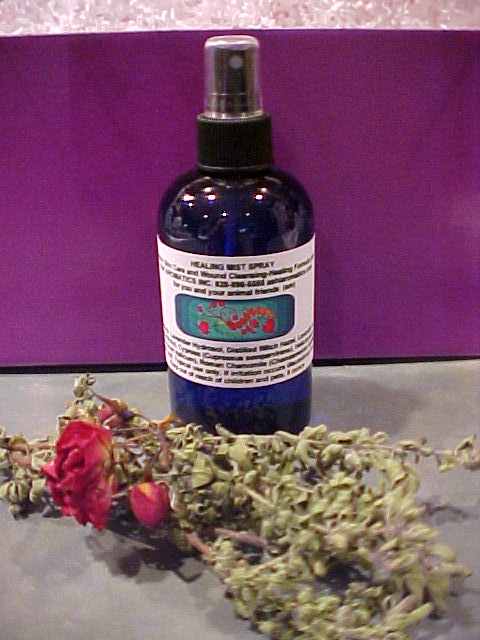
Identify the location of gray counter/table. (75, 609).